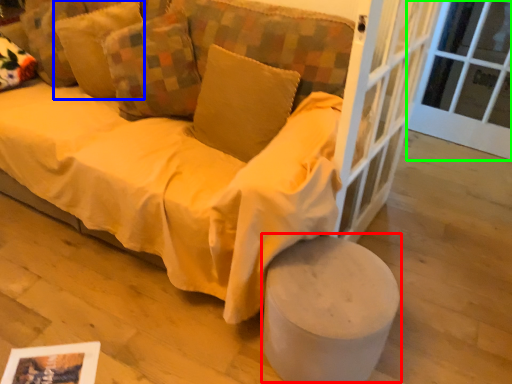
Question: Which is nearer to the stool (highlighted by a red box)? pillow (highlighted by a blue box) or window frame (highlighted by a green box).

Choices:
 (A) pillow
 (B) window frame

Answer: (A)